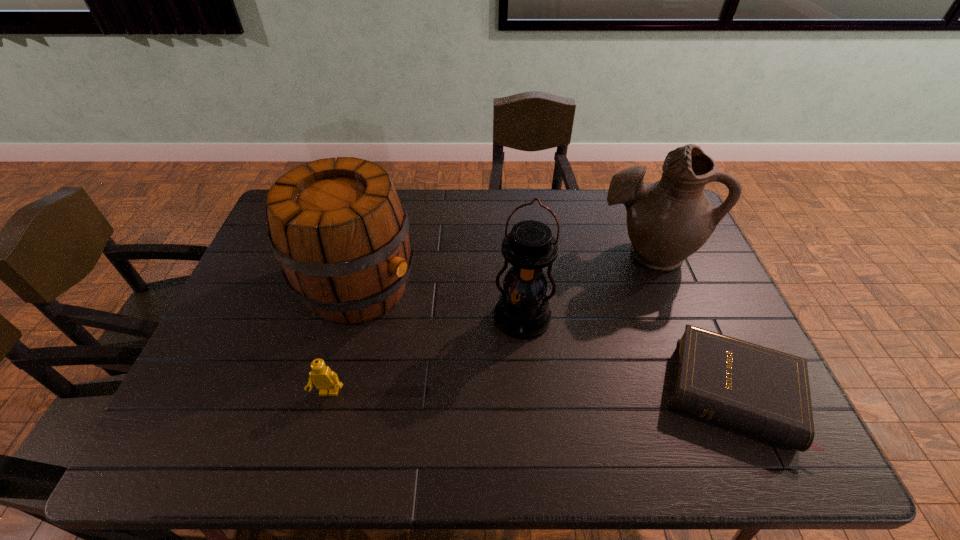
The height and width of the screenshot is (540, 960). Identify the location of unoccupied area between the shortest object and the second shortest object. (531, 393).

Identify the location of empty space between the cider and the Lego. This screenshot has height=540, width=960. (344, 339).

Where is `vacant point located between the lantern and the shortest object`? Image resolution: width=960 pixels, height=540 pixels. vacant point located between the lantern and the shortest object is located at coordinates (627, 356).

Image resolution: width=960 pixels, height=540 pixels. I want to click on empty location between the Bible and the Lego, so click(x=531, y=393).

Where is `free space between the Lego and the pitcher`? The image size is (960, 540). free space between the Lego and the pitcher is located at coordinates click(488, 323).

At what (x,y) coordinates should I click in order to perform the action: click on vacant point located between the fourth tallest object and the third object from right to left. Please return your answer as a coordinate pair (x, y). This screenshot has width=960, height=540. Looking at the image, I should click on (426, 356).

You are a GUI agent. You are given a task and a screenshot of the screen. Output one action in this format:
    pyautogui.click(x=<x>, y=<y>)
    Task: Click on the unoccupied area between the Bible and the pitcher
    
    Given the screenshot: What is the action you would take?
    pyautogui.click(x=689, y=323)

Identify which object is the fourth nearest to the pitcher. Please provide its 2D coordinates. Your answer should be formatted as a tuple, i.e. [(x, y)], where the tuple contains the x and y coordinates of a point satisfying the conditions above.

[(324, 379)]

Find the location of a particular element. object that can be found as the third closest to the Bible is located at coordinates (338, 228).

Locate an element on the screen. This screenshot has width=960, height=540. free spot that satisfies the following two spatial constraints: 1. on the back side of the cider; 2. on the right side of the pitcher is located at coordinates (367, 254).